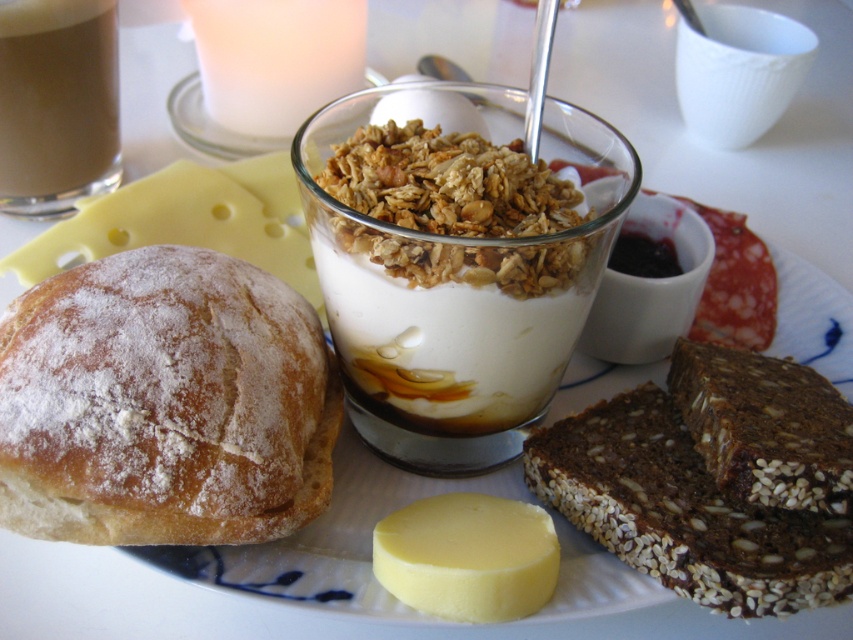
Image resolution: width=853 pixels, height=640 pixels. What do you see at coordinates (163, 403) in the screenshot? I see `golden brown crusty loaf at lower left` at bounding box center [163, 403].

Who is lower down, golden brown crusty loaf at lower left or smooth brown liquid at upper left?

golden brown crusty loaf at lower left is below.

Is point (328, 476) closer to viewer compared to point (28, 88)?

That is True.

At what (x,y) coordinates should I click in order to perform the action: click on golden brown crusty loaf at lower left. Please return your answer as a coordinate pair (x, y). This screenshot has height=640, width=853. Looking at the image, I should click on (163, 403).

Is brown seeded bread at lower right in front of yellow creamy cheese at center?

Yes, brown seeded bread at lower right is in front of yellow creamy cheese at center.

Who is more distant from viewer, (828, 602) or (477, 620)?

Positioned behind is point (828, 602).

Where is `brown seeded bread at lower right`? brown seeded bread at lower right is located at coordinates (683, 512).

Locate an element on the screen. The height and width of the screenshot is (640, 853). brown seeded bread at lower right is located at coordinates (683, 512).

Measure the distance between point (756, 436) and camera.

The distance of point (756, 436) from camera is 15.71 inches.

Between seeded brown bread at lower right and yellow creamy cheese at center, which one appears on the right side from the viewer's perspective?

seeded brown bread at lower right is more to the right.

In order to click on seeded brown bread at lower right in this screenshot , I will do `click(764, 426)`.

Locate an element on the screen. This screenshot has height=640, width=853. seeded brown bread at lower right is located at coordinates (764, 426).